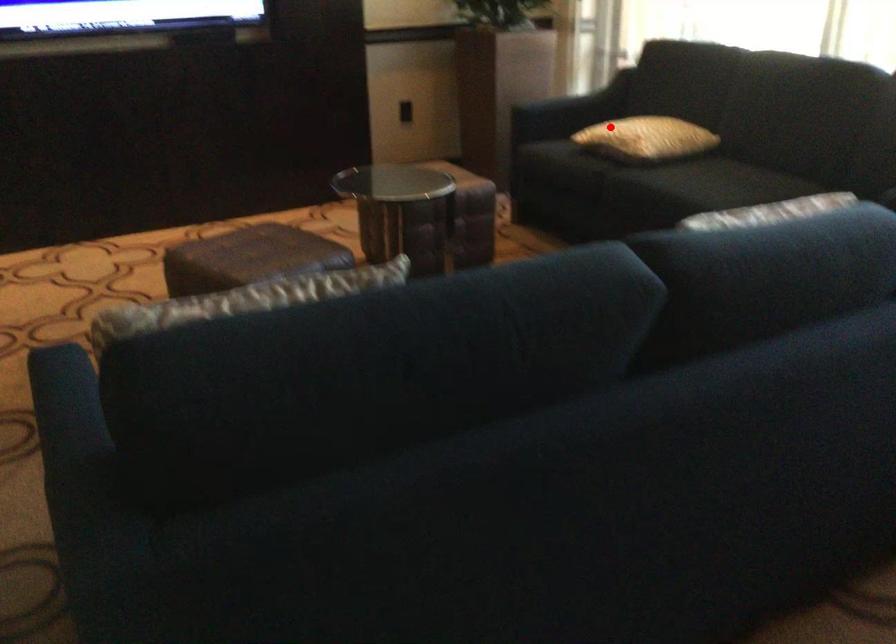
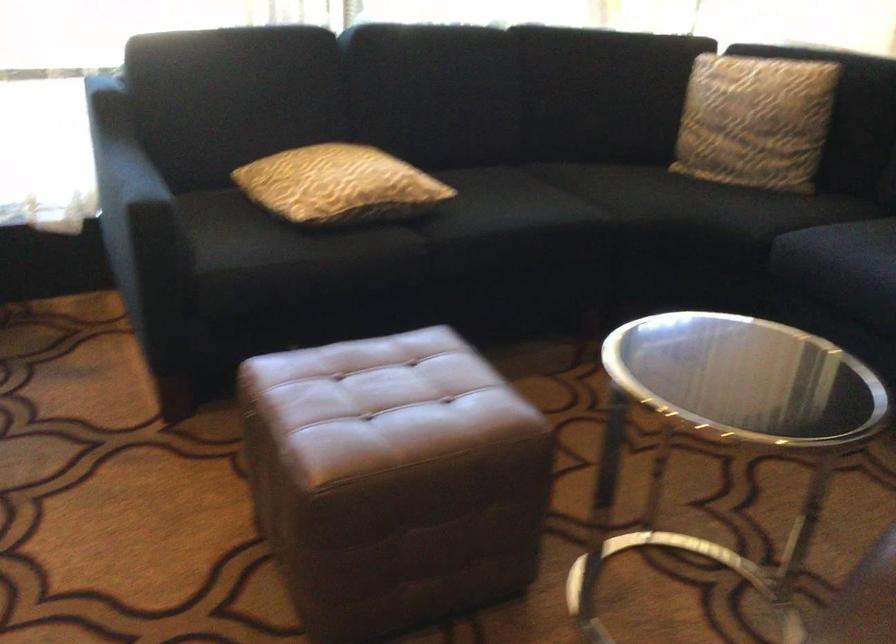
Where in the second image is the point corresponding to the highlighted location from the first image?

(339, 185)